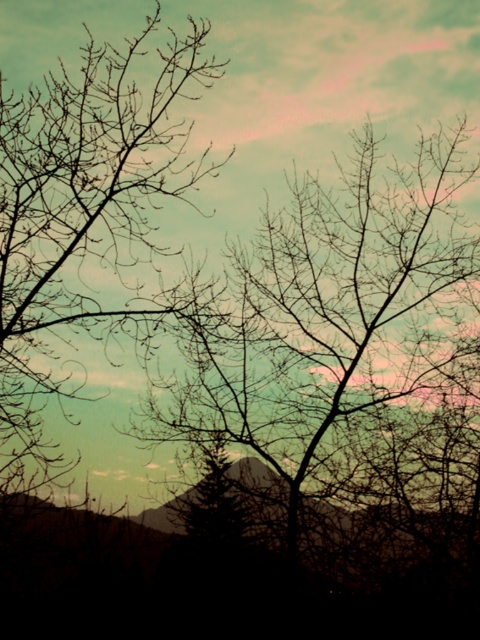
Question: Which object is farther from the camera taking this photo?

Choices:
 (A) silhouette bark tree at upper left
 (B) silhouette bare branches at left

Answer: (A)

Question: Is silhouette bark tree at upper left bigger than silhouette bare branches at left?

Choices:
 (A) yes
 (B) no

Answer: (A)

Question: Is silhouette bark tree at upper left thinner than silhouette bare branches at left?

Choices:
 (A) yes
 (B) no

Answer: (B)

Question: Can you confirm if silhouette bark tree at upper left is positioned to the right of silhouette bare branches at left?

Choices:
 (A) no
 (B) yes

Answer: (B)

Question: Which point is closer to the camera?

Choices:
 (A) silhouette bare branches at left
 (B) silhouette bark tree at upper left

Answer: (A)